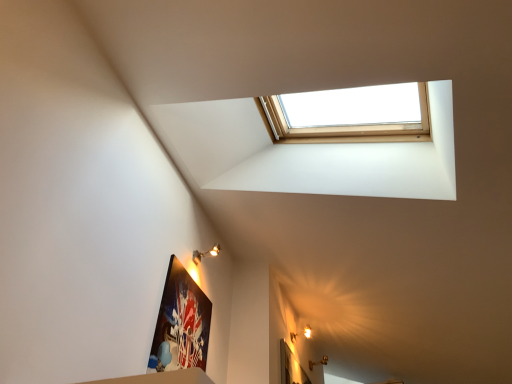
Question: Considering the relative sizes of matte gold wall sconce at upper right, which ranks as the second light fixture in front-to-back order, and matte gold light fixture at upper center, which is the 1th light fixture in left-to-right order, in the image provided, is matte gold wall sconce at upper right, which ranks as the second light fixture in front-to-back order, taller than matte gold light fixture at upper center, which is the 1th light fixture in left-to-right order,?

Choices:
 (A) yes
 (B) no

Answer: (B)

Question: From the image's perspective, is matte gold wall sconce at upper right, positioned as the first light fixture in bottom-to-top order, above matte gold light fixture at upper center, the second light fixture from the right?

Choices:
 (A) yes
 (B) no

Answer: (B)

Question: Can you confirm if matte gold wall sconce at upper right, which is counted as the 1th light fixture, starting from the back, is positioned to the right of matte gold light fixture at upper center, which is the 1th light fixture in front-to-back order?

Choices:
 (A) yes
 (B) no

Answer: (A)

Question: Is matte gold wall sconce at upper right, the second light fixture viewed from the left, shorter than matte gold light fixture at upper center, which ranks as the 2th light fixture in back-to-front order?

Choices:
 (A) no
 (B) yes

Answer: (B)

Question: Is matte gold wall sconce at upper right, positioned as the first light fixture in bottom-to-top order, behind matte gold light fixture at upper center, which is the 1th light fixture in left-to-right order?

Choices:
 (A) no
 (B) yes

Answer: (B)

Question: Does point (215, 251) appear closer or farther from the camera than point (176, 314)?

Choices:
 (A) closer
 (B) farther

Answer: (B)

Question: Would you say matte gold light fixture at upper center, positioned as the second light fixture in bottom-to-top order, is to the left or to the right of matte black picture frame at lower left in the picture?

Choices:
 (A) left
 (B) right

Answer: (B)

Question: From the image's perspective, relative to matte black picture frame at lower left, is matte gold light fixture at upper center, which is the 1th light fixture in front-to-back order, above or below?

Choices:
 (A) above
 (B) below

Answer: (A)

Question: Based on their sizes in the image, would you say matte gold light fixture at upper center, positioned as the second light fixture in bottom-to-top order, is bigger or smaller than matte black picture frame at lower left?

Choices:
 (A) big
 (B) small

Answer: (B)

Question: Is matte gold wall sconce at upper right, the second light fixture viewed from the left, situated inside matte gold light fixture at upper center, which is the 1th light fixture in left-to-right order, or outside?

Choices:
 (A) outside
 (B) inside

Answer: (A)

Question: Visually, is matte gold wall sconce at upper right, which is counted as the 2th light fixture, starting from the top, positioned to the left or to the right of matte gold light fixture at upper center, positioned as the second light fixture in bottom-to-top order?

Choices:
 (A) left
 (B) right

Answer: (B)

Question: In terms of height, does matte gold wall sconce at upper right, which ranks as the second light fixture in front-to-back order, look taller or shorter compared to matte gold light fixture at upper center, the second light fixture from the right?

Choices:
 (A) short
 (B) tall

Answer: (A)

Question: Considering the positions of matte gold wall sconce at upper right, positioned as the first light fixture in bottom-to-top order, and matte gold light fixture at upper center, positioned as the second light fixture in bottom-to-top order, in the image, is matte gold wall sconce at upper right, positioned as the first light fixture in bottom-to-top order, wider or thinner than matte gold light fixture at upper center, positioned as the second light fixture in bottom-to-top order,?

Choices:
 (A) wide
 (B) thin

Answer: (B)

Question: Which is correct: matte black picture frame at lower left is inside matte gold light fixture at upper center, which is the 1th light fixture in left-to-right order, or outside of it?

Choices:
 (A) outside
 (B) inside

Answer: (A)

Question: In the image, is matte black picture frame at lower left positioned in front of or behind matte gold light fixture at upper center, which is the 1th light fixture in front-to-back order?

Choices:
 (A) front
 (B) behind

Answer: (A)